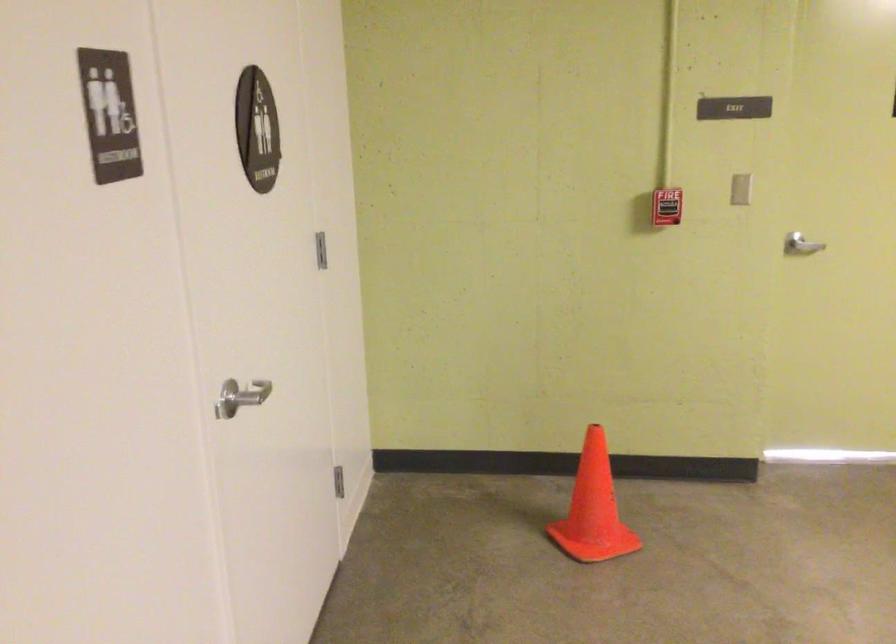
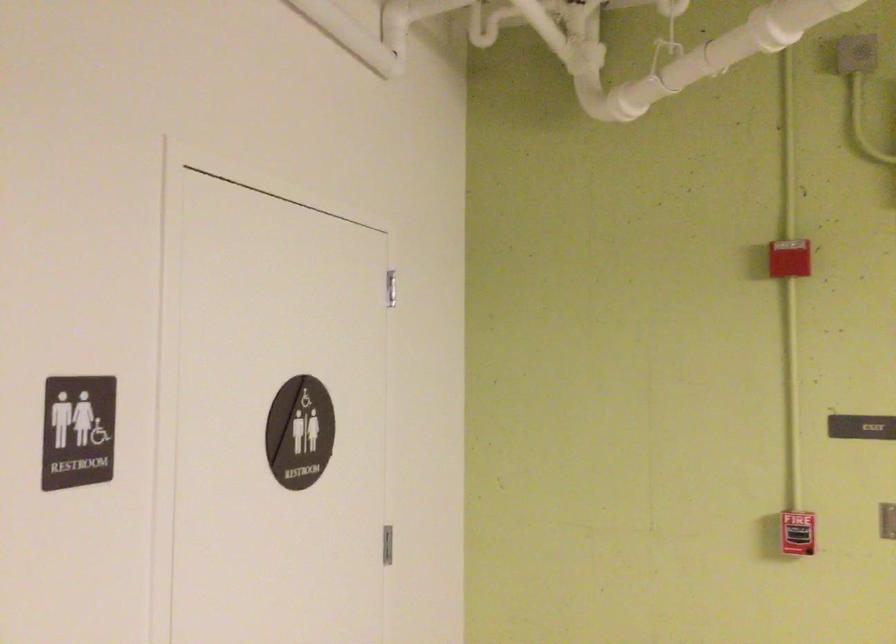
Based on the continuous images, in which direction is the camera rotating?

The camera's rotation is toward left-up.